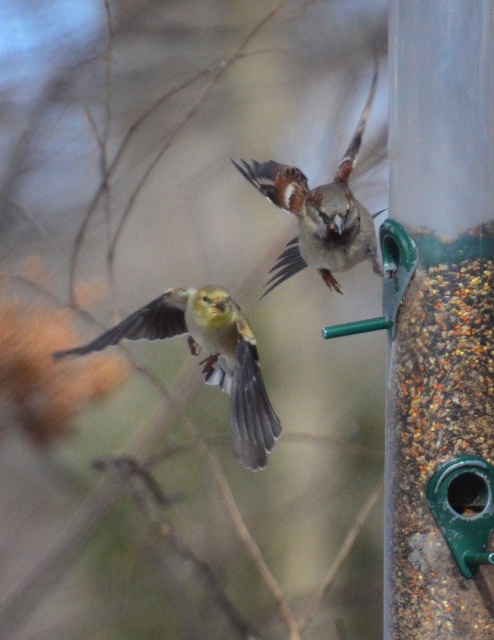
You are a birdwatcher observing the golden yellow sparrow at left and the brown speckled feathers at center. Which bird is positioned lower in the image?

The golden yellow sparrow at left is positioned lower than the brown speckled feathers at center.

You are a birdwatcher trying to identify birds at the feeder. You notice the golden yellow sparrow at left and the brown speckled feathers at center. Which bird is shorter in height?

The golden yellow sparrow at left is not as tall as brown speckled feathers at center, so the golden yellow sparrow at left is shorter in height.